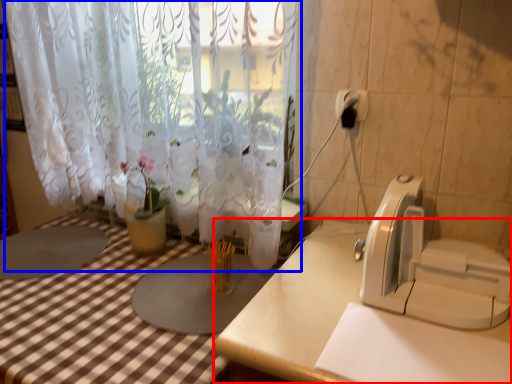
Question: Which of the following is the closest to the observer, table (highlighted by a red box) or curtain (highlighted by a blue box)?

Choices:
 (A) table
 (B) curtain

Answer: (A)